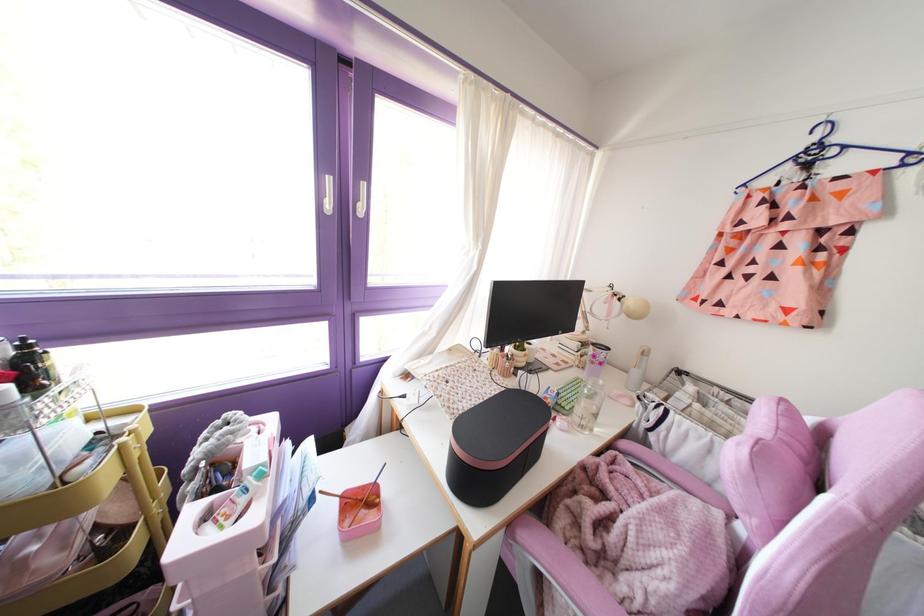
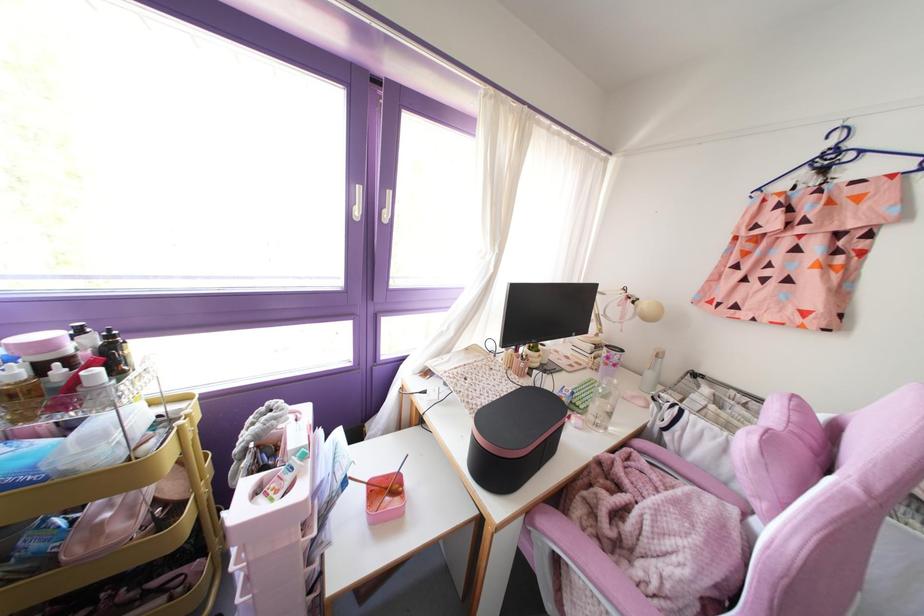
The point at (634,371) is marked in the first image. Where is the corresponding point in the second image?

(649, 374)